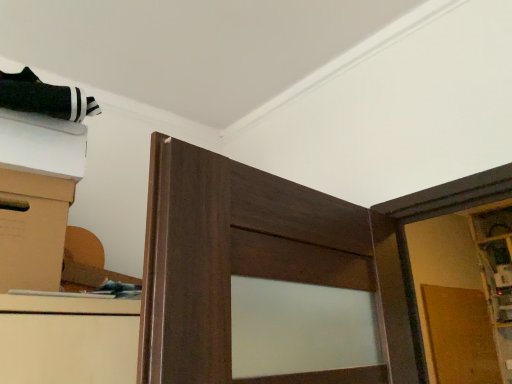
Locate an element on the screen. The height and width of the screenshot is (384, 512). brown cardboard box at left is located at coordinates [33, 230].

What do you see at coordinates (33, 230) in the screenshot?
I see `brown cardboard box at left` at bounding box center [33, 230].

Image resolution: width=512 pixels, height=384 pixels. In order to click on matte brown cabinet at right in this screenshot , I will do point(496,273).

Describe the element at coordinates (496, 273) in the screenshot. I see `matte brown cabinet at right` at that location.

Find the location of `brown cardboard box at left`. brown cardboard box at left is located at coordinates (33, 230).

Is brown cardboard box at left to the left or to the right of matte brown cabinet at right in the image?

In the image, brown cardboard box at left appears on the left side of matte brown cabinet at right.

Is the position of brown cardboard box at left more distant than that of matte brown cabinet at right?

That is False.

Which point is more forward, (x=68, y=202) or (x=498, y=283)?

The point (x=68, y=202) is more forward.

From the image's perspective, which is below, brown cardboard box at left or matte brown cabinet at right?

From the image's view, matte brown cabinet at right is below.

From a real-world perspective, who is located higher, brown cardboard box at left or matte brown cabinet at right?

From a 3D spatial view, matte brown cabinet at right is above.

Considering the sizes of brown cardboard box at left and matte brown cabinet at right in the image, is brown cardboard box at left wider or thinner than matte brown cabinet at right?

Considering their sizes, brown cardboard box at left looks broader than matte brown cabinet at right.

Considering the relative sizes of brown cardboard box at left and matte brown cabinet at right in the image provided, is brown cardboard box at left taller than matte brown cabinet at right?

No, brown cardboard box at left is not taller than matte brown cabinet at right.

Does brown cardboard box at left have a larger size compared to matte brown cabinet at right?

No.

Consider the image. Is brown cardboard box at left spatially inside matte brown cabinet at right, or outside of it?

The correct answer is: outside.

Is brown cardboard box at left placed right next to matte brown cabinet at right?

No, brown cardboard box at left is not making contact with matte brown cabinet at right.

Is brown cardboard box at left aimed at matte brown cabinet at right?

No, brown cardboard box at left is not oriented towards matte brown cabinet at right.

Measure the distance from brown cardboard box at left to matte brown cabinet at right.

A distance of 3.11 meters exists between brown cardboard box at left and matte brown cabinet at right.

Where is `cabinetry behind the brown cardboard box at left`? cabinetry behind the brown cardboard box at left is located at coordinates (496, 273).

Considering the positions of objects matte brown cabinet at right and brown cardboard box at left in the image provided, who is more to the right, matte brown cabinet at right or brown cardboard box at left?

matte brown cabinet at right is more to the right.

Considering the positions of objects matte brown cabinet at right and brown cardboard box at left in the image provided, who is behind, matte brown cabinet at right or brown cardboard box at left?

matte brown cabinet at right is behind.

Is point (487, 284) less distant than point (4, 225)?

No, it is behind (4, 225).

From the image's perspective, is matte brown cabinet at right positioned above or below brown cardboard box at left?

Based on their image positions, matte brown cabinet at right is located beneath brown cardboard box at left.

From a real-world perspective, is matte brown cabinet at right positioned above or below brown cardboard box at left?

From a real-world perspective, matte brown cabinet at right is physically above brown cardboard box at left.

In terms of width, does matte brown cabinet at right look wider or thinner when compared to brown cardboard box at left?

Considering their sizes, matte brown cabinet at right looks slimmer than brown cardboard box at left.

From the picture: Considering the sizes of matte brown cabinet at right and brown cardboard box at left in the image, is matte brown cabinet at right taller or shorter than brown cardboard box at left?

Considering their sizes, matte brown cabinet at right has more height than brown cardboard box at left.

Can you confirm if matte brown cabinet at right is smaller than brown cardboard box at left?

No, matte brown cabinet at right is not smaller than brown cardboard box at left.

Consider the image. Is matte brown cabinet at right inside or outside of brown cardboard box at left?

matte brown cabinet at right is not inside brown cardboard box at left, it's outside.

Is matte brown cabinet at right beside brown cardboard box at left?

No.

Is matte brown cabinet at right positioned with its back to brown cardboard box at left?

No, matte brown cabinet at right is not facing the opposite direction of brown cardboard box at left.

How many degrees apart are the facing directions of matte brown cabinet at right and brown cardboard box at left?

85.9 degrees.

Find the location of a particular element. The height and width of the screenshot is (384, 512). cardboard box above the matte brown cabinet at right (from the image's perspective) is located at coordinates (33, 230).

You are a GUI agent. You are given a task and a screenshot of the screen. Output one action in this format:
    pyautogui.click(x=<x>, y=<y>)
    Task: Click on the cabinetry behind the brown cardboard box at left
    The height and width of the screenshot is (384, 512).
    Given the screenshot: What is the action you would take?
    pyautogui.click(x=496, y=273)

At what (x,y) coordinates should I click in order to perform the action: click on cabinetry positioned vertically above the brown cardboard box at left (from a real-world perspective). Please return your answer as a coordinate pair (x, y). This screenshot has width=512, height=384. Looking at the image, I should click on (496, 273).